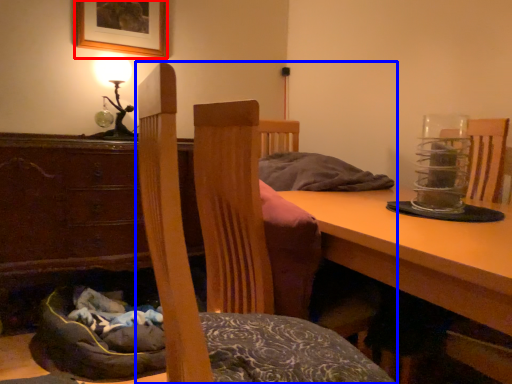
Question: Which of the following is the farthest to the observer, picture frame (highlighted by a red box) or chair (highlighted by a blue box)?

Choices:
 (A) picture frame
 (B) chair

Answer: (A)